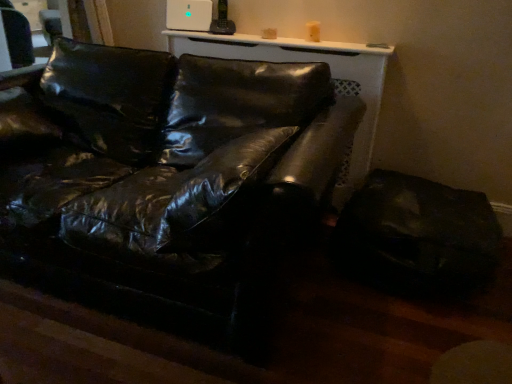
The height and width of the screenshot is (384, 512). Identify the location of vacant area in front of shiny black leather swivel chair at lower right. (409, 342).